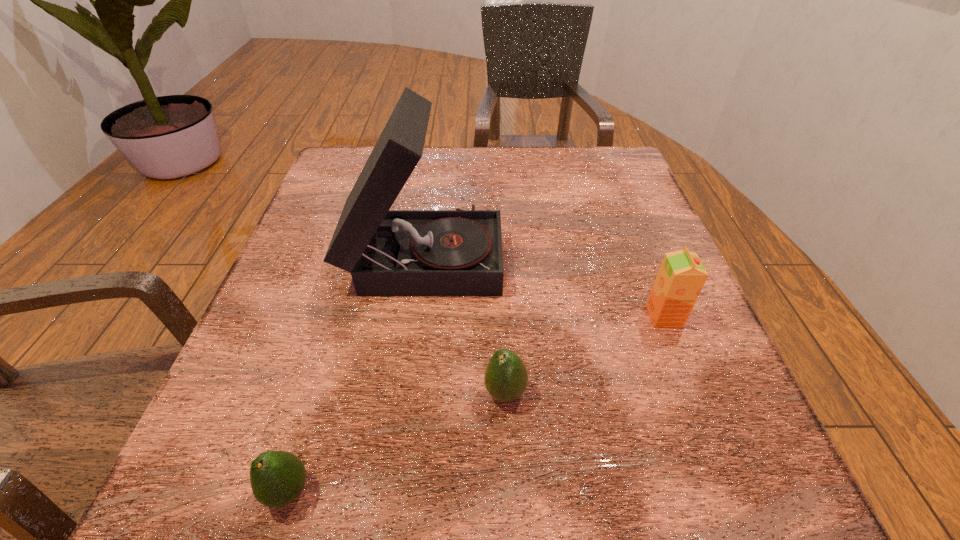
Locate an element on the screen. The image size is (960, 540). vacant area that lies between the third nearest object and the farthest object is located at coordinates (544, 285).

Image resolution: width=960 pixels, height=540 pixels. I want to click on vacant area between the orange juice and the tallest object, so (x=544, y=285).

The image size is (960, 540). What are the coordinates of `free space between the third farthest object and the third shortest object` in the screenshot? It's located at (585, 354).

Where is `the closest object to the farther avocado`? the closest object to the farther avocado is located at coordinates (458, 252).

Locate which object is the third closest to the phonograph_record. Please provide its 2D coordinates. Your answer should be formatted as a tuple, i.e. [(x, y)], where the tuple contains the x and y coordinates of a point satisfying the conditions above.

[(277, 478)]

Locate an element on the screen. The image size is (960, 540). vacant space that satisfies the following two spatial constraints: 1. on the front-facing side of the farthest object; 2. on the front side of the left avocado is located at coordinates (392, 491).

This screenshot has height=540, width=960. Find the location of `free spot that satisfies the following two spatial constraints: 1. on the front-facing side of the second farthest object; 2. on the right side of the tallest object`. free spot that satisfies the following two spatial constraints: 1. on the front-facing side of the second farthest object; 2. on the right side of the tallest object is located at coordinates (416, 316).

At what (x,y) coordinates should I click in order to perform the action: click on vacant point that satisfies the following two spatial constraints: 1. on the front-facing side of the farthest object; 2. on the back side of the right avocado. Please return your answer as a coordinate pair (x, y). This screenshot has height=540, width=960. Looking at the image, I should click on (405, 393).

Locate an element on the screen. The height and width of the screenshot is (540, 960). blank space that satisfies the following two spatial constraints: 1. on the front-facing side of the tallest object; 2. on the left side of the farther avocado is located at coordinates (405, 393).

You are a GUI agent. You are given a task and a screenshot of the screen. Output one action in this format:
    pyautogui.click(x=<x>, y=<y>)
    Task: Click on the vacant area that satisfies the following two spatial constraints: 1. on the back side of the second tallest object; 2. on the right side of the farther avocado
    
    Given the screenshot: What is the action you would take?
    pyautogui.click(x=501, y=316)